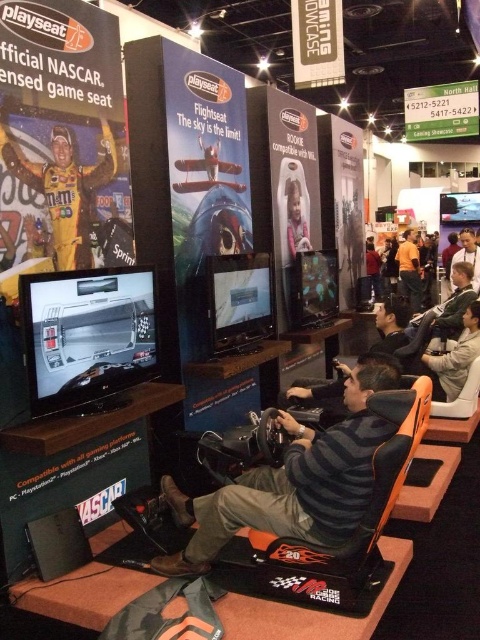
Based on the photo, you are setting up a display for a gaming convention and have limited space. You need to place both the matte yellow racing suit at upper left and the matte black racing seat at center. Which item should you prioritize placing first if you want to maximize space efficiency?

The matte yellow racing suit at upper left should be prioritized since it occupies less space than the matte black racing seat at center, allowing you to place the larger item afterward without space constraints.

You are a game developer attending the convention and need to present a new racing game demo. You want to demonstrate the game using the orange fabric racing seat at center and the matte yellow racing suit at upper left. Which object should you place on your right side during the presentation?

The orange fabric racing seat at center should be placed on your right side because it is positioned on the right side of the matte yellow racing suit at upper left according to the scene description.

You are a game designer evaluating the setup. Which object is taller between the orange fabric racing seat at center and the matte yellow racing suit at upper left?

The orange fabric racing seat at center is taller than the matte yellow racing suit at upper left.